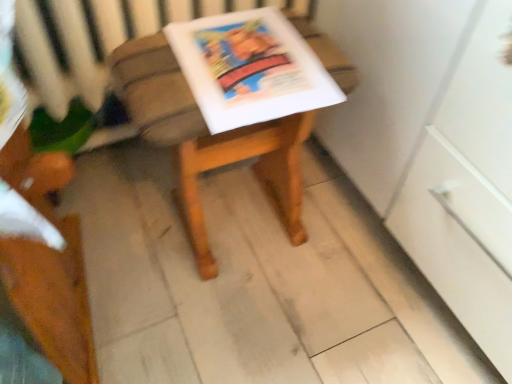
Find the location of a particular element. free space above wooden table at center (from a real-world perspective) is located at coordinates (192, 74).